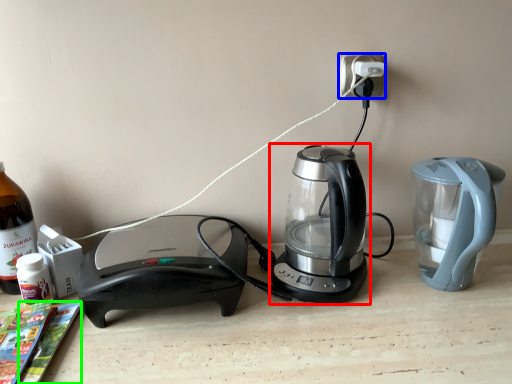
Question: Which object is the farthest from kettle (highlighted by a red box)? Choose among these: electric outlet (highlighted by a blue box) or magazine (highlighted by a green box).

Choices:
 (A) electric outlet
 (B) magazine

Answer: (B)